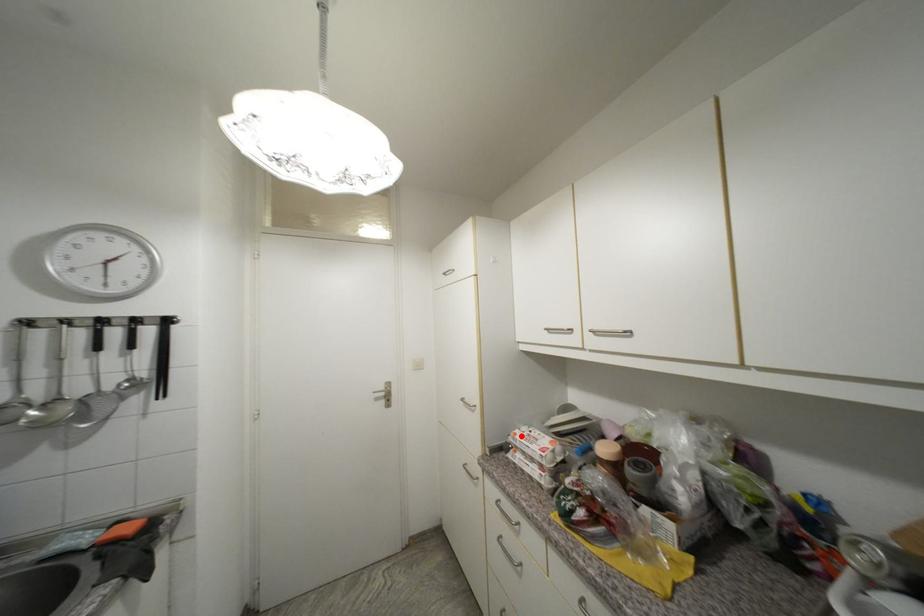
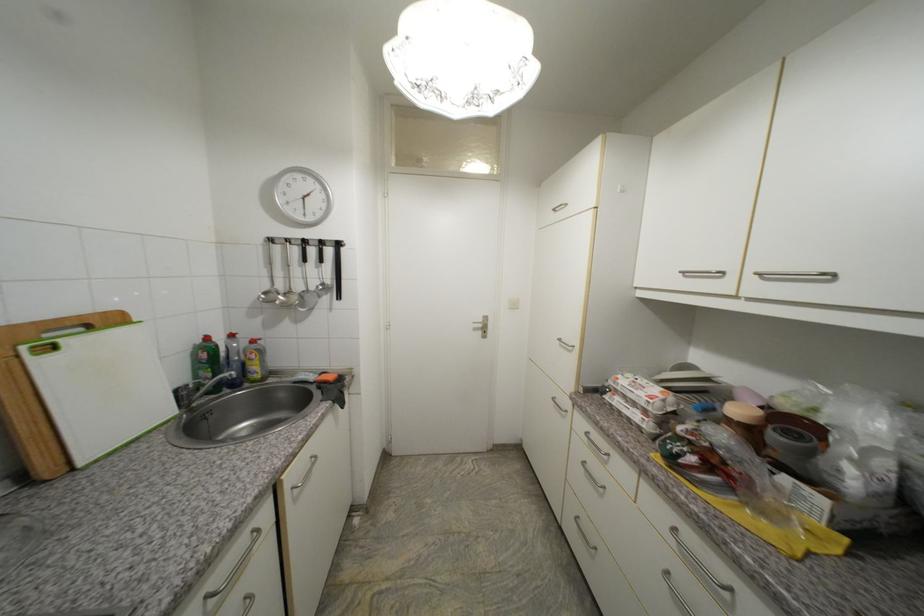
Locate, in the second image, the point that corresponds to the highlighted location in the first image.

(623, 379)